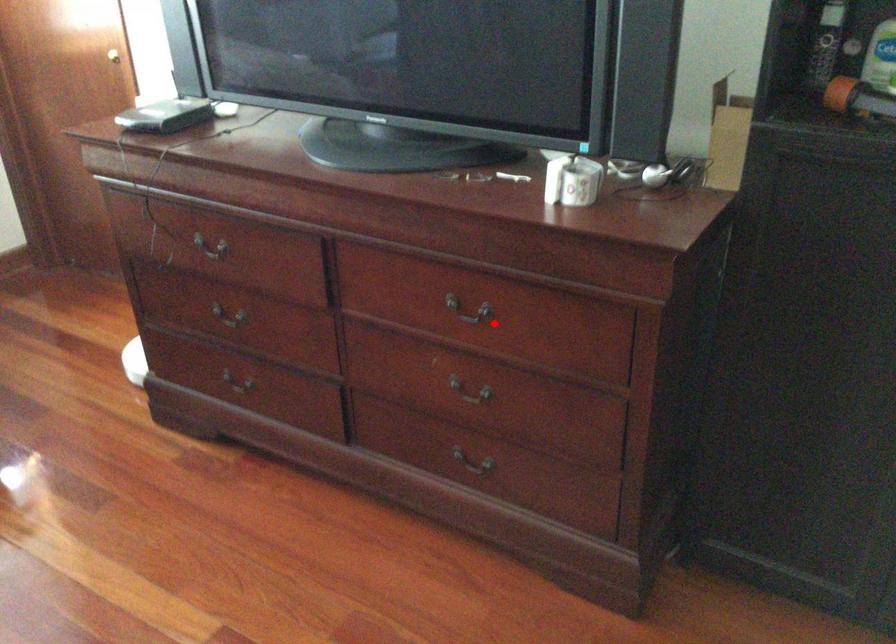
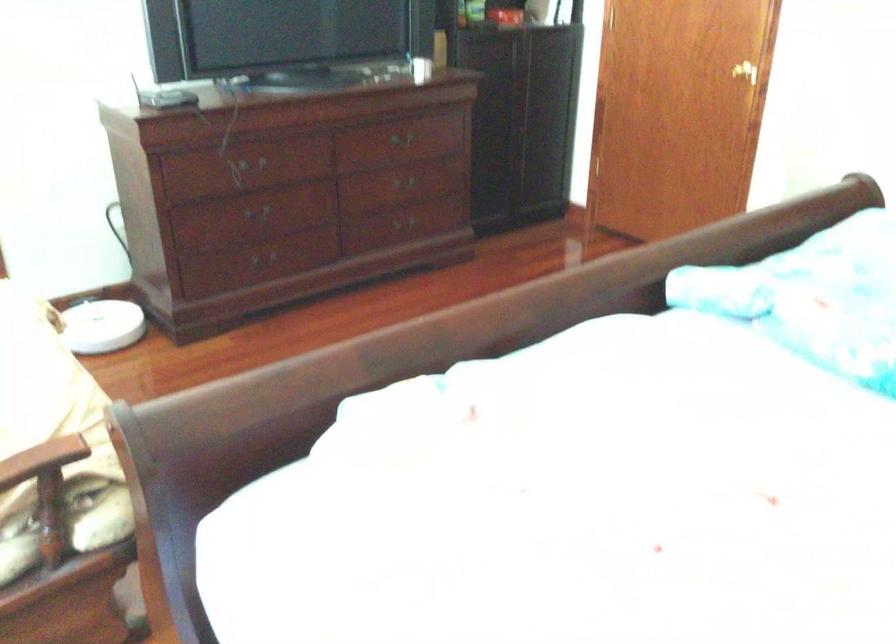
Question: I am providing you with two images of the same scene from different viewpoints. A red point is marked on the first image. At the location where the point appears in image 1, is it still visible in image 2?

Choices:
 (A) Yes
 (B) No

Answer: (A)